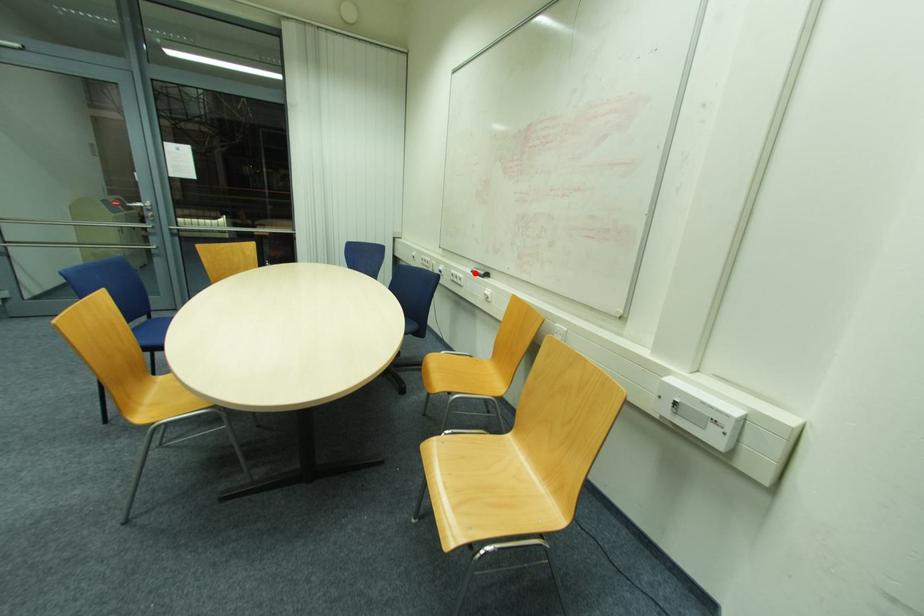
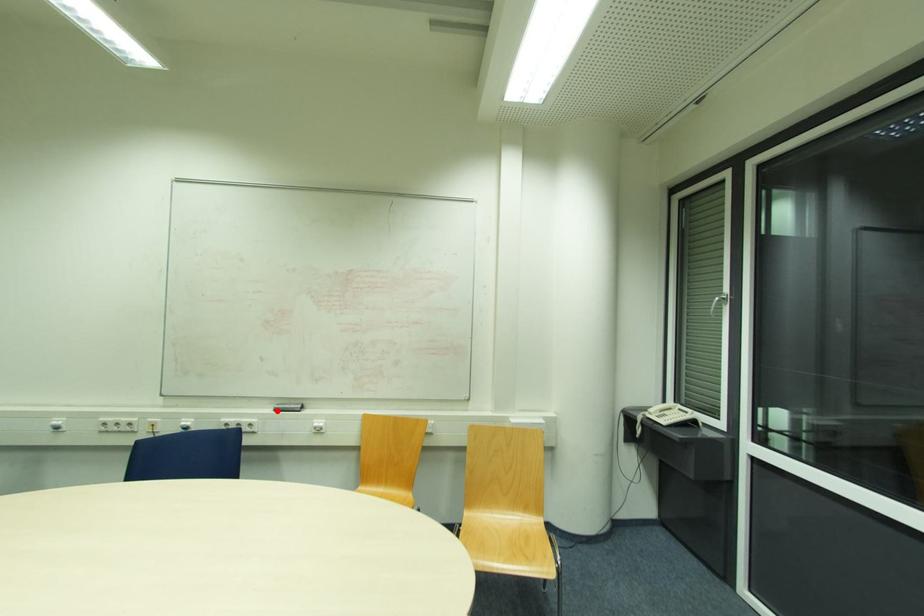
I am providing you with two images of the same scene from different viewpoints. A red point is marked on the first image and another point is marked on the second image. Are the points marked in image1 and image2 representing the same 3D position?

Yes